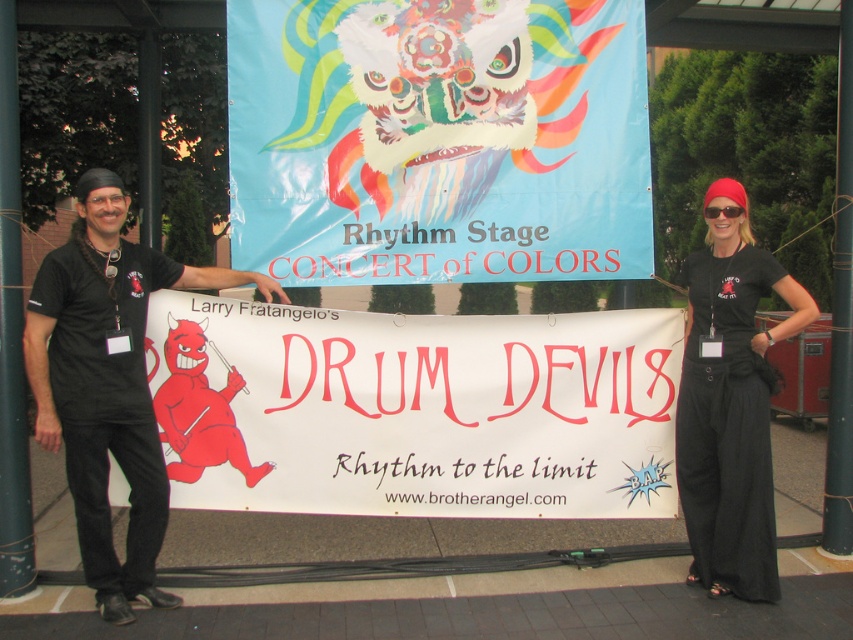
Two people are holding a banner on a stage. They are standing at point (x=68, y=317). How far apart are they?

The two people standing at point (x=68, y=317) are 4.08 meters apart.